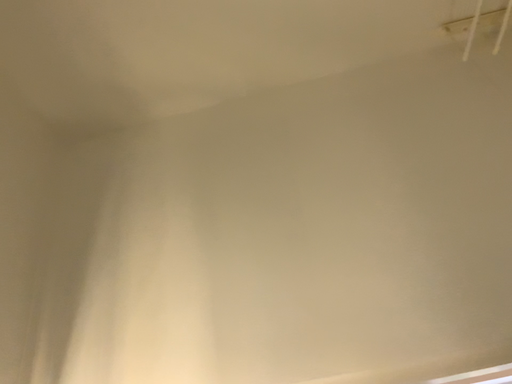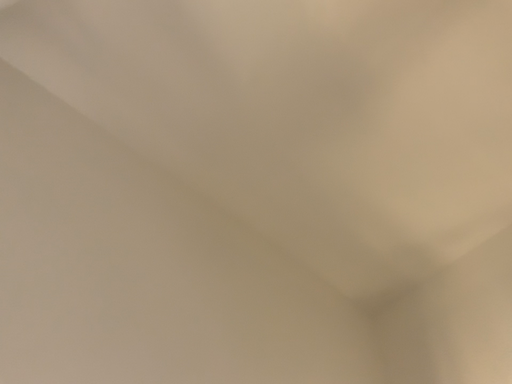
Question: How did the camera likely rotate when shooting the video?

Choices:
 (A) rotated downward
 (B) rotated upward

Answer: (B)